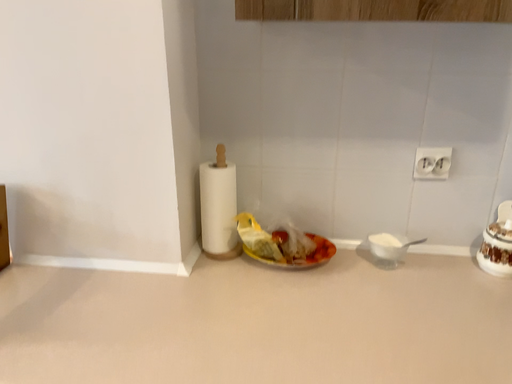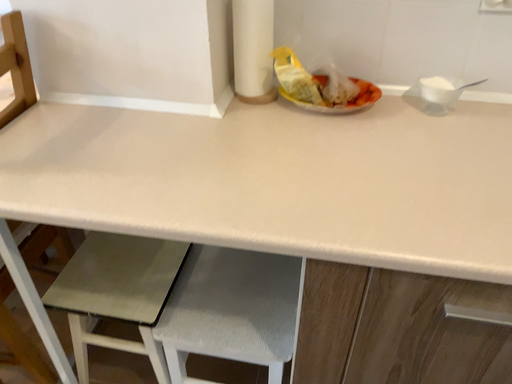
Question: How did the camera likely rotate when shooting the video?

Choices:
 (A) rotated downward
 (B) rotated upward

Answer: (A)